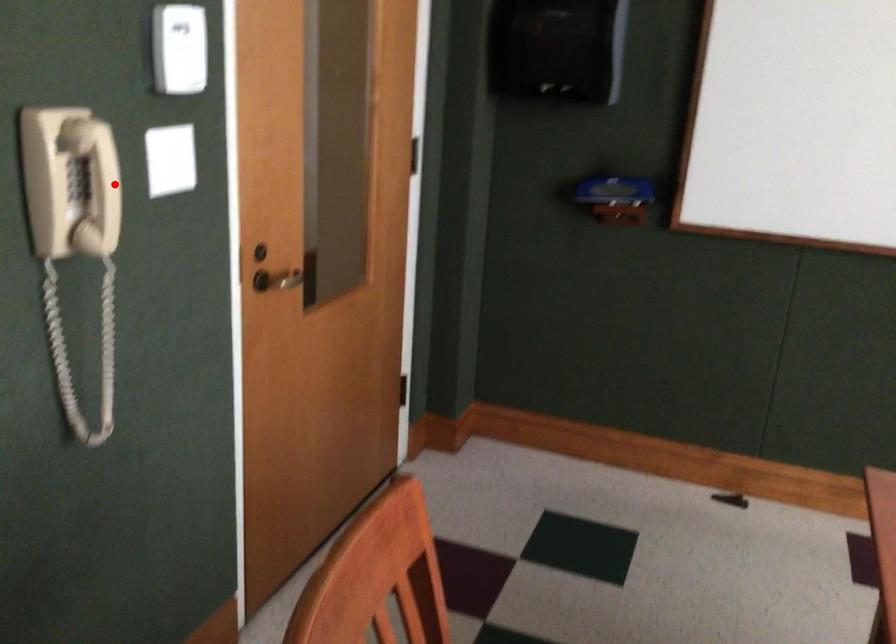
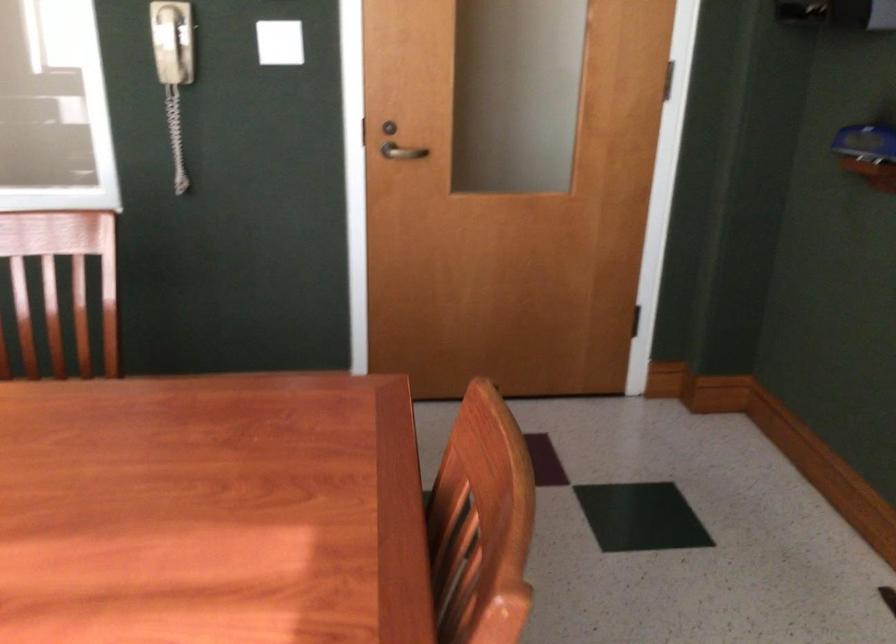
Question: I am providing you with two images of the same scene from different viewpoints. Image1 has a red point marked. In image2, the corresponding 3D location appears at what relative position? Reply with the corresponding letter.

Choices:
 (A) Closer
 (B) Farther

Answer: (B)